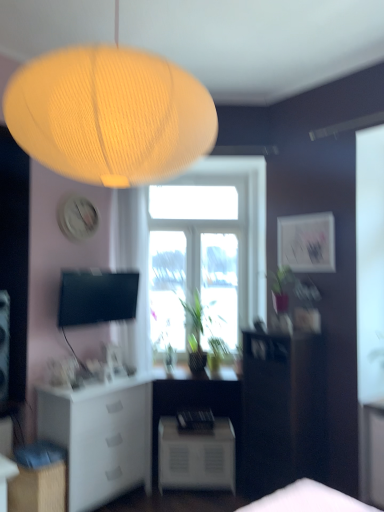
Question: Is transparent glass window at center inside or outside of dark wood cabinet at right?

Choices:
 (A) outside
 (B) inside

Answer: (A)

Question: Is transparent glass window at center in front of or behind dark wood cabinet at right in the image?

Choices:
 (A) behind
 (B) front

Answer: (A)

Question: Which of these objects is positioned farthest from the white matte cabinet at lower left, positioned as the 2th cabinetry in back-to-front order?

Choices:
 (A) matte white picture frame at upper right
 (B) white matte nightstand at lower center
 (C) matte yellow paper lamp at upper center
 (D) white matte cabinet at lower left, the 2th cabinetry from the front
 (E) transparent glass window at center

Answer: (A)

Question: Based on their relative distances, which object is nearer to the transparent glass window at center?

Choices:
 (A) white matte cabinet at lower left, the 2th cabinetry from the front
 (B) matte white picture frame at upper right
 (C) dark wood cabinet at right
 (D) matte yellow paper lamp at upper center
 (E) white matte cabinet at lower left, positioned as the 2th cabinetry in back-to-front order

Answer: (B)